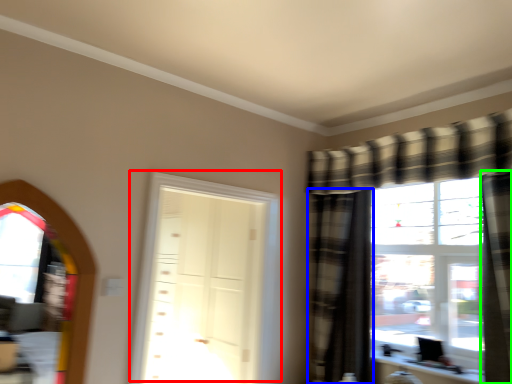
Question: Which object is the farthest from door (highlighted by a red box)? Choose among these: curtain (highlighted by a blue box) or curtain (highlighted by a green box).

Choices:
 (A) curtain
 (B) curtain

Answer: (B)